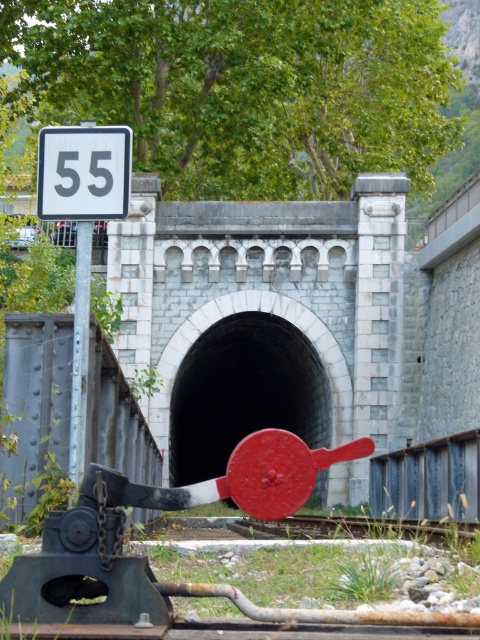
Is black stone tunnel at center behind white plastic speed limit sign at upper left?

Yes, it is.

Identify the location of black stone tunnel at center. (243, 392).

Is white plastic speed limit sign at upper left in front of metal train track at center?

Yes, it is in front of metal train track at center.

Which is behind, point (41, 164) or point (448, 532)?

Point (448, 532)

Describe the element at coordinates (84, 172) in the screenshot. This screenshot has height=640, width=480. I see `white plastic speed limit sign at upper left` at that location.

What are the coordinates of `white plastic speed limit sign at upper left` in the screenshot? It's located at (84, 172).

Does black stone tunnel at center have a greater height compared to metal train track at center?

Correct, black stone tunnel at center is much taller as metal train track at center.

Is point (208, 404) less distant than point (406, 522)?

No, (208, 404) is behind (406, 522).

You are a GUI agent. You are given a task and a screenshot of the screen. Output one action in this format:
    pyautogui.click(x=<x>, y=<y>)
    Task: Click on the black stone tunnel at center
    This screenshot has width=480, height=640.
    Given the screenshot: What is the action you would take?
    pyautogui.click(x=243, y=392)